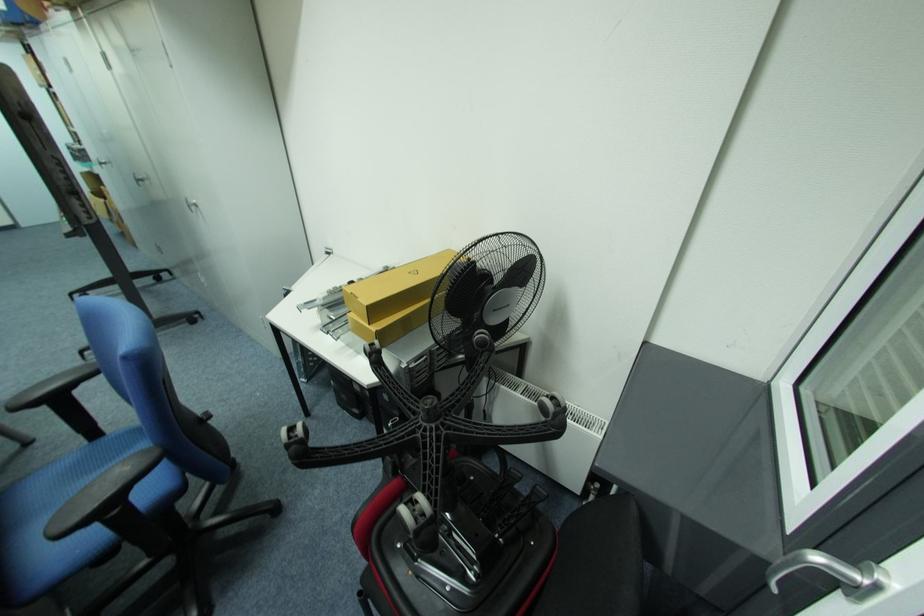
At what (x,y) coordinates should I click in order to perform the action: click on black chair wheel. Please return your answer as a coordinate pair (x, y). Looking at the image, I should click on (169, 546).